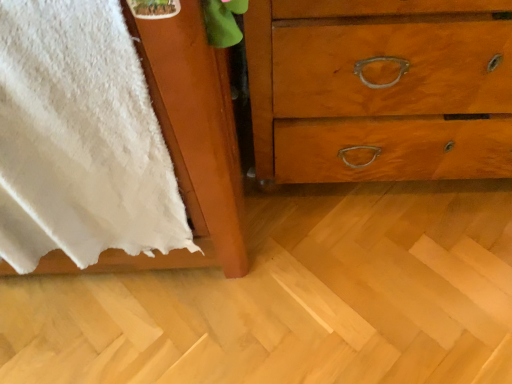
What do you see at coordinates (192, 140) in the screenshot?
I see `white soft fabric at left` at bounding box center [192, 140].

Identify the location of white soft fabric at left. pos(192,140).

Where is `white soft fabric at left`? white soft fabric at left is located at coordinates (192, 140).